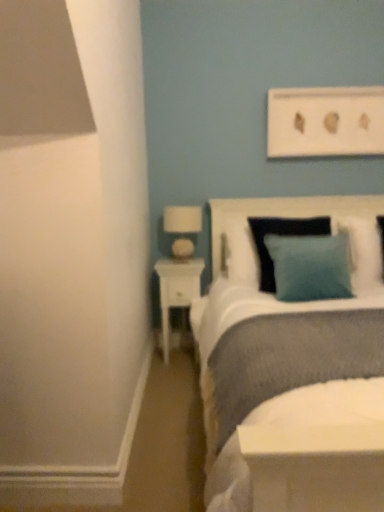
Question: Is teal fabric pillow at upper right, positioned as the 1th pillow in back-to-front order, closer to the viewer compared to white fabric lampshade at upper left?

Choices:
 (A) yes
 (B) no

Answer: (A)

Question: Considering the relative sizes of teal fabric pillow at upper right, which is the first pillow in right-to-left order, and white fabric lampshade at upper left in the image provided, is teal fabric pillow at upper right, which is the first pillow in right-to-left order, shorter than white fabric lampshade at upper left?

Choices:
 (A) yes
 (B) no

Answer: (B)

Question: Is teal fabric pillow at upper right, the 2th pillow viewed from the left, not close to white fabric lampshade at upper left?

Choices:
 (A) no
 (B) yes

Answer: (A)

Question: Is teal fabric pillow at upper right, which ranks as the 2th pillow in front-to-back order, taller than white fabric lampshade at upper left?

Choices:
 (A) yes
 (B) no

Answer: (A)

Question: Is white fabric lampshade at upper left a part of teal fabric pillow at upper right, the 2th pillow viewed from the left?

Choices:
 (A) yes
 (B) no

Answer: (B)

Question: Is teal fabric pillow at upper right, which is the first pillow in right-to-left order, not inside white fabric lampshade at upper left?

Choices:
 (A) no
 (B) yes

Answer: (B)

Question: Can you confirm if white fabric lampshade at upper left is smaller than white glossy nightstand at lower left?

Choices:
 (A) no
 (B) yes

Answer: (B)

Question: Is white fabric lampshade at upper left not close to white glossy nightstand at lower left?

Choices:
 (A) yes
 (B) no

Answer: (B)

Question: Is white fabric lampshade at upper left shorter than white glossy nightstand at lower left?

Choices:
 (A) no
 (B) yes

Answer: (B)

Question: Is white fabric lampshade at upper left to the right of white glossy nightstand at lower left from the viewer's perspective?

Choices:
 (A) yes
 (B) no

Answer: (A)

Question: Is white fabric lampshade at upper left oriented towards white glossy nightstand at lower left?

Choices:
 (A) no
 (B) yes

Answer: (A)

Question: From the image's perspective, is white fabric lampshade at upper left beneath white glossy nightstand at lower left?

Choices:
 (A) no
 (B) yes

Answer: (A)

Question: From a real-world perspective, is teal fabric pillow at upper right, the 2th pillow viewed from the left, under textured white headboard at upper right?

Choices:
 (A) yes
 (B) no

Answer: (B)